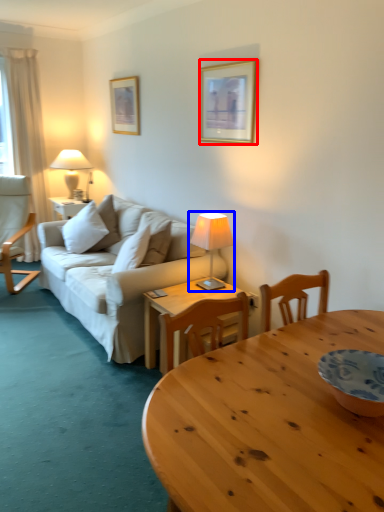
Question: Which point is further to the camera, picture frame (highlighted by a red box) or lamp (highlighted by a blue box)?

Choices:
 (A) picture frame
 (B) lamp

Answer: (A)